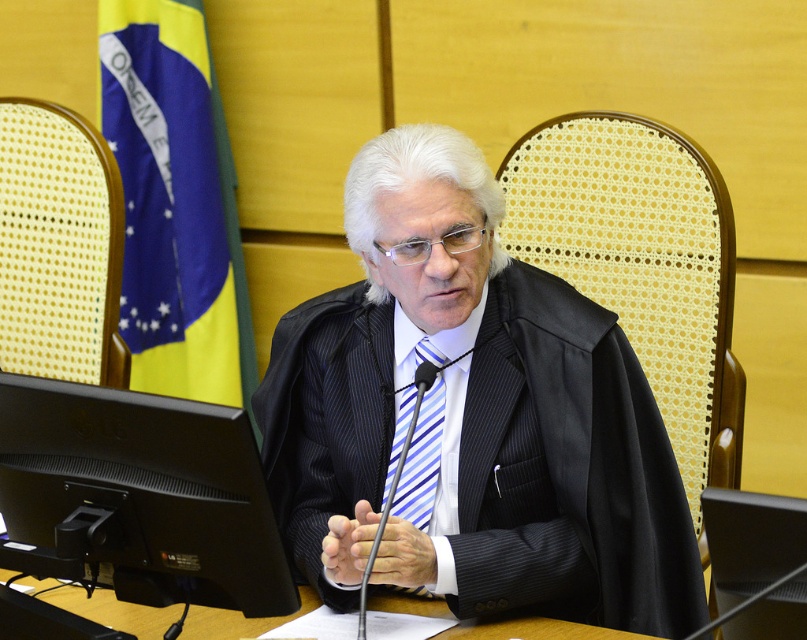
Question: Can you confirm if blue fabric flag at upper left is positioned below wooden table at center?

Choices:
 (A) no
 (B) yes

Answer: (A)

Question: Estimate the real-world distances between objects in this image. Which object is closer to the black glossy monitor at lower left?

Choices:
 (A) blue striped tie at center
 (B) wooden table at center
 (C) blue fabric flag at upper left
 (D) black pinstripe suit at center

Answer: (B)

Question: Can you confirm if wooden table at center is positioned below blue striped tie at center?

Choices:
 (A) yes
 (B) no

Answer: (A)

Question: From the image, what is the correct spatial relationship of black pinstripe suit at center in relation to black glossy monitor at lower left?

Choices:
 (A) below
 (B) above

Answer: (B)

Question: Which of these objects is positioned farthest from the black pinstripe suit at center?

Choices:
 (A) wooden table at center
 (B) blue fabric flag at upper left

Answer: (B)

Question: Which of the following is the closest to the observer?

Choices:
 (A) (128, 444)
 (B) (318, 515)
 (C) (63, 593)
 (D) (224, 301)

Answer: (A)